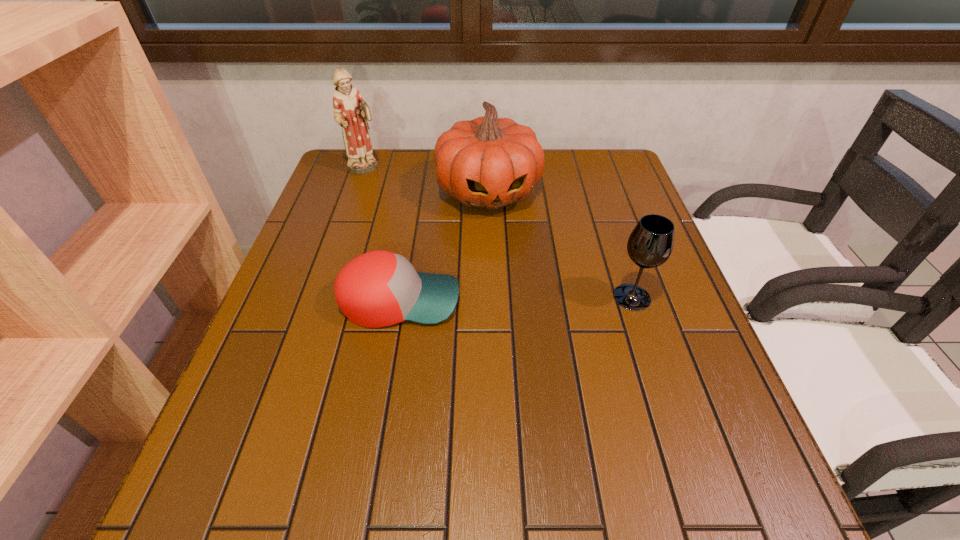
This screenshot has width=960, height=540. What are the coordinates of `the shortest object` in the screenshot? It's located at (379, 288).

This screenshot has height=540, width=960. What are the coordinates of `the rightmost object` in the screenshot? It's located at (650, 244).

Where is `the third tallest object`? This screenshot has width=960, height=540. the third tallest object is located at coordinates (650, 244).

Where is `pumpkin`? The width and height of the screenshot is (960, 540). pumpkin is located at coordinates (486, 162).

The height and width of the screenshot is (540, 960). I want to click on the tallest object, so click(351, 112).

This screenshot has height=540, width=960. I want to click on free location located at the brim of the shortest object, so click(642, 300).

Find the location of a particular element. Image resolution: width=960 pixels, height=540 pixels. free location located 0.120m on the left of the rightmost object is located at coordinates (559, 297).

The height and width of the screenshot is (540, 960). Identify the location of vacant space located on the face of the pumpkin. (526, 327).

This screenshot has width=960, height=540. In order to click on vacant area situated on the face of the pumpkin in this screenshot , I will do `click(507, 256)`.

Locate an element on the screen. This screenshot has height=540, width=960. blank space located 0.180m on the face of the pumpkin is located at coordinates (511, 271).